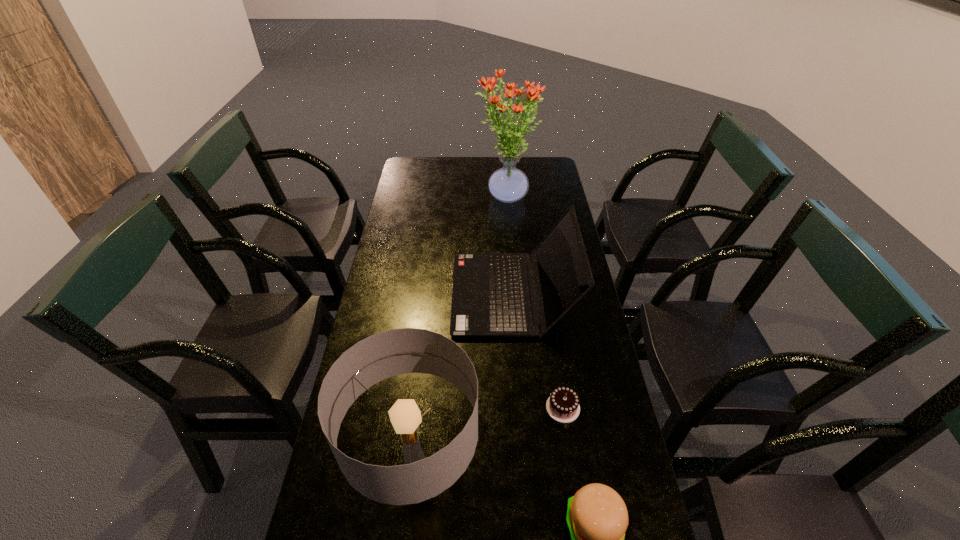
Where is `the farthest object`? Image resolution: width=960 pixels, height=540 pixels. the farthest object is located at coordinates (508, 184).

Locate an element on the screen. the tallest object is located at coordinates (508, 184).

Image resolution: width=960 pixels, height=540 pixels. I want to click on the fourth nearest object, so click(x=490, y=297).

This screenshot has height=540, width=960. I want to click on laptop computer, so click(490, 297).

Identify the location of the third farthest object. The image size is (960, 540). (563, 406).

At what (x,y) coordinates should I click in order to perform the action: click on the shortest object. Please return your answer as a coordinate pair (x, y). The image size is (960, 540). Looking at the image, I should click on (563, 406).

This screenshot has width=960, height=540. Find the location of `vacant space located 0.120m on the back of the farthest object`. vacant space located 0.120m on the back of the farthest object is located at coordinates (503, 167).

I want to click on free space located on the screen of the second farthest object, so click(420, 294).

Locate an element on the screen. This screenshot has width=960, height=540. free space located on the screen of the second farthest object is located at coordinates (408, 294).

In order to click on free region located 0.060m on the screen of the second farthest object in this screenshot , I will do `click(435, 294)`.